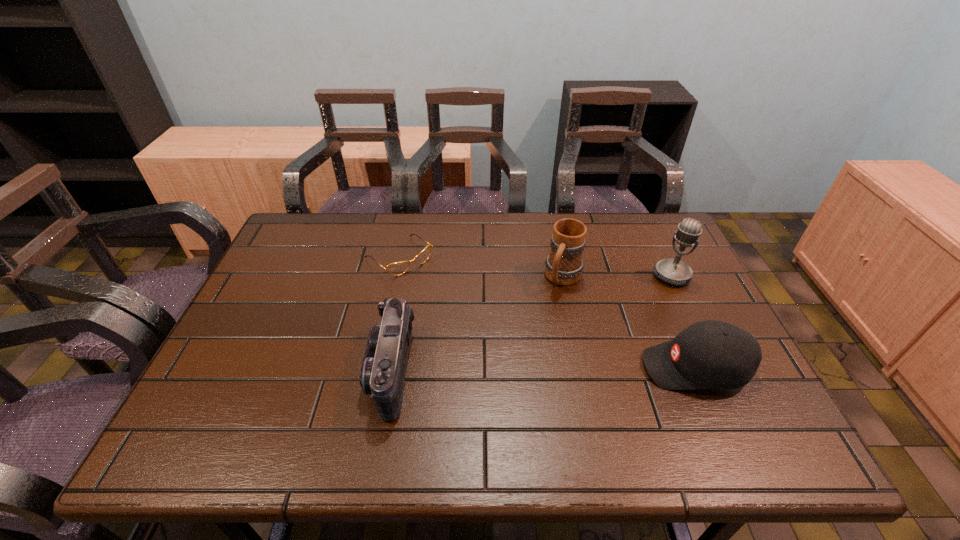
At what (x,y) coordinates should I click in order to perform the action: click on camcorder. Please return your answer as a coordinate pair (x, y). Looking at the image, I should click on (383, 370).

Image resolution: width=960 pixels, height=540 pixels. What are the coordinates of `baseball cap` in the screenshot? It's located at (710, 354).

At what (x,y) coordinates should I click in order to perform the action: click on the tallest object. Please return your answer as a coordinate pair (x, y). The height and width of the screenshot is (540, 960). Looking at the image, I should click on (673, 271).

The width and height of the screenshot is (960, 540). What are the coordinates of `the fourth shortest object` in the screenshot? It's located at (563, 266).

Where is `mug`? The height and width of the screenshot is (540, 960). mug is located at coordinates (563, 266).

At what (x,y) coordinates should I click in order to perform the action: click on the shortest object. Please return your answer as a coordinate pair (x, y). This screenshot has width=960, height=540. Looking at the image, I should click on tap(398, 268).

Locate an element on the screen. This screenshot has width=960, height=540. free spot located on the front-facing side of the camcorder is located at coordinates (281, 370).

Where is `blank space located 0.130m on the front-facing side of the camcorder`? The image size is (960, 540). blank space located 0.130m on the front-facing side of the camcorder is located at coordinates (316, 370).

This screenshot has height=540, width=960. I want to click on vacant space located 0.130m on the front-facing side of the camcorder, so click(316, 370).

This screenshot has width=960, height=540. In order to click on free space located with a logo on the front of the baseball cap in this screenshot , I will do `click(592, 368)`.